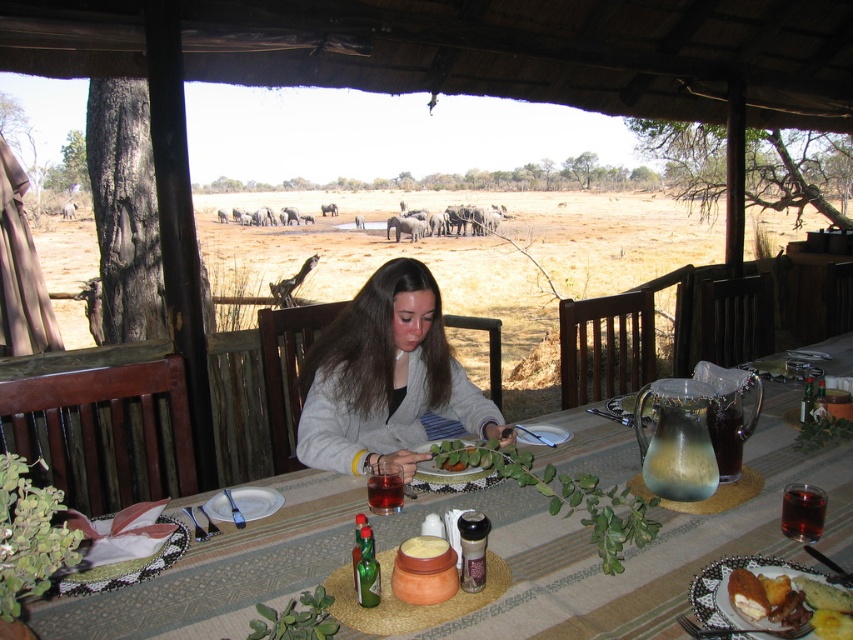
Question: Is matte glass pitcher at center positioned at the back of white ceramic plate at lower left?

Choices:
 (A) no
 (B) yes

Answer: (A)

Question: Estimate the real-world distances between objects in this image. Which object is closer to the yellow matte bowl at center?

Choices:
 (A) matte glass plate at center
 (B) green leafy vegetable at center
 (C) light gray fleece at center
 (D) white ceramic plate at lower left

Answer: (B)

Question: Which point appears closest to the camera in this image?

Choices:
 (A) (271, 506)
 (B) (428, 557)
 (C) (450, 444)

Answer: (B)

Question: Which object is the farthest from the golden brown bread at center?

Choices:
 (A) green leafy vegetable at center
 (B) matte glass pitcher at center
 (C) yellow matte bowl at center

Answer: (A)

Question: Does light gray fleece at center appear over green leafy vegetable at center?

Choices:
 (A) no
 (B) yes

Answer: (B)

Question: Can you confirm if light gray fleece at center is bigger than green leafy vegetable at center?

Choices:
 (A) no
 (B) yes

Answer: (B)